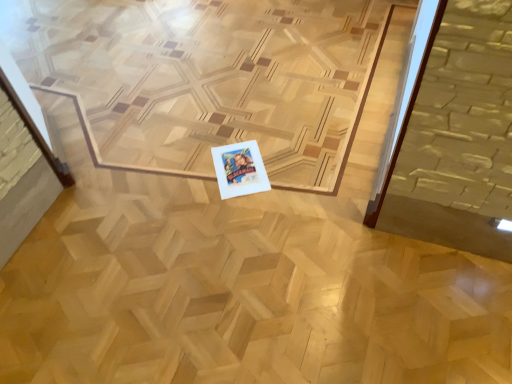
Question: From the image's perspective, is natural wood plywood at center above or below white paper at center?

Choices:
 (A) below
 (B) above

Answer: (B)

Question: From a real-world perspective, is natural wood plywood at center positioned above or below white paper at center?

Choices:
 (A) above
 (B) below

Answer: (A)

Question: Is natural wood plywood at center taller or shorter than white paper at center?

Choices:
 (A) short
 (B) tall

Answer: (B)

Question: Which is correct: white paper at center is inside natural wood plywood at center, or outside of it?

Choices:
 (A) outside
 (B) inside

Answer: (B)

Question: From a real-world perspective, relative to natural wood plywood at center, is white paper at center vertically above or below?

Choices:
 (A) below
 (B) above

Answer: (A)

Question: From the image's perspective, is white paper at center located above or below natural wood plywood at center?

Choices:
 (A) below
 (B) above

Answer: (A)

Question: Based on their positions, is white paper at center located to the left or right of natural wood plywood at center?

Choices:
 (A) left
 (B) right

Answer: (B)